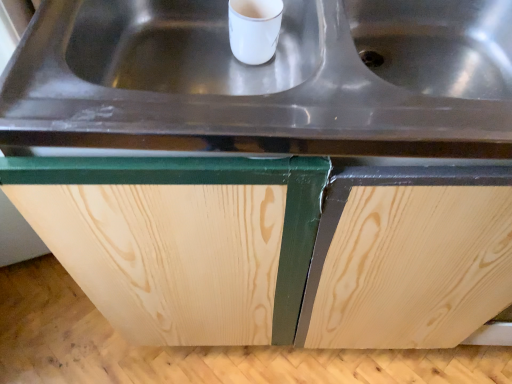
Describe the element at coordinates (268, 251) in the screenshot. I see `natural wood cabinet at center` at that location.

Locate an element on the screen. The width and height of the screenshot is (512, 384). natural wood cabinet at center is located at coordinates (268, 251).

Where is `stainless steel sink at center`? This screenshot has height=384, width=512. stainless steel sink at center is located at coordinates (264, 78).

The width and height of the screenshot is (512, 384). What do you see at coordinates (264, 78) in the screenshot?
I see `stainless steel sink at center` at bounding box center [264, 78].

Identify the location of natural wood cabinet at center. Image resolution: width=512 pixels, height=384 pixels. (268, 251).

Can you confirm if natural wood cabinet at center is positioned to the left of stainless steel sink at center?

Yes, natural wood cabinet at center is to the left of stainless steel sink at center.

Relative to stainless steel sink at center, is natural wood cabinet at center in front or behind?

Visually, natural wood cabinet at center is located behind stainless steel sink at center.

Which is in front, point (178, 327) or point (153, 118)?

The point (153, 118) is closer.

From the image's perspective, is natural wood cabinet at center under stainless steel sink at center?

Correct, natural wood cabinet at center appears lower than stainless steel sink at center in the image.

From a real-world perspective, between natural wood cabinet at center and stainless steel sink at center, who is vertically lower?

In real-world perspective, natural wood cabinet at center is lower.

Between natural wood cabinet at center and stainless steel sink at center, which one has larger width?

Wider between the two is natural wood cabinet at center.

From their relative heights in the image, would you say natural wood cabinet at center is taller or shorter than stainless steel sink at center?

natural wood cabinet at center is taller than stainless steel sink at center.

Does natural wood cabinet at center have a larger size compared to stainless steel sink at center?

Indeed, natural wood cabinet at center has a larger size compared to stainless steel sink at center.

Is natural wood cabinet at center surrounding stainless steel sink at center?

Yes, stainless steel sink at center is surrounded by natural wood cabinet at center.

Would you say natural wood cabinet at center is a long distance from stainless steel sink at center?

Actually, natural wood cabinet at center and stainless steel sink at center are a little close together.

Could you tell me if natural wood cabinet at center is facing stainless steel sink at center?

No.

Can you tell me how much natural wood cabinet at center and stainless steel sink at center differ in facing direction?

There is a 0.369-degree angle between the facing directions of natural wood cabinet at center and stainless steel sink at center.

You are a GUI agent. You are given a task and a screenshot of the screen. Output one action in this format:
    pyautogui.click(x=<x>, y=<y>)
    Task: Click on the sink positioned vertically above the natural wood cabinet at center (from a real-world perspective)
    The height and width of the screenshot is (384, 512).
    Given the screenshot: What is the action you would take?
    pyautogui.click(x=264, y=78)

Considering the relative positions of stainless steel sink at center and natural wood cabinet at center in the image provided, is stainless steel sink at center to the left or to the right of natural wood cabinet at center?

stainless steel sink at center is to the right of natural wood cabinet at center.

Consider the image. Is stainless steel sink at center positioned behind natural wood cabinet at center?

That is False.

Between point (70, 6) and point (72, 258), which one is positioned behind?

The point (72, 258) is farther.

From the image's perspective, is stainless steel sink at center under natural wood cabinet at center?

No, from the image's perspective, stainless steel sink at center is not beneath natural wood cabinet at center.

From a real-world perspective, which is physically below, stainless steel sink at center or natural wood cabinet at center?

natural wood cabinet at center, from a real-world perspective.

Looking at this image, can you confirm if stainless steel sink at center is thinner than natural wood cabinet at center?

Correct, the width of stainless steel sink at center is less than that of natural wood cabinet at center.

Is stainless steel sink at center shorter than natural wood cabinet at center?

Yes, stainless steel sink at center is shorter than natural wood cabinet at center.

Can you confirm if stainless steel sink at center is smaller than natural wood cabinet at center?

Indeed, stainless steel sink at center has a smaller size compared to natural wood cabinet at center.

Would you say stainless steel sink at center is outside natural wood cabinet at center?

No, stainless steel sink at center is inside or overlapping with natural wood cabinet at center.

Would you say stainless steel sink at center is a long distance from natural wood cabinet at center?

No, stainless steel sink at center is not far from natural wood cabinet at center.

Is stainless steel sink at center aimed at natural wood cabinet at center?

Yes, stainless steel sink at center is facing natural wood cabinet at center.

How far apart are stainless steel sink at center and natural wood cabinet at center?

A distance of 9.46 inches exists between stainless steel sink at center and natural wood cabinet at center.

Identify the location of cabinetry beneath the stainless steel sink at center (from a real-world perspective). (268, 251).

At what (x,y) coordinates should I click in order to perform the action: click on sink that is in front of the natural wood cabinet at center. Please return your answer as a coordinate pair (x, y). Looking at the image, I should click on (264, 78).

I want to click on sink that appears above the natural wood cabinet at center (from a real-world perspective), so click(x=264, y=78).